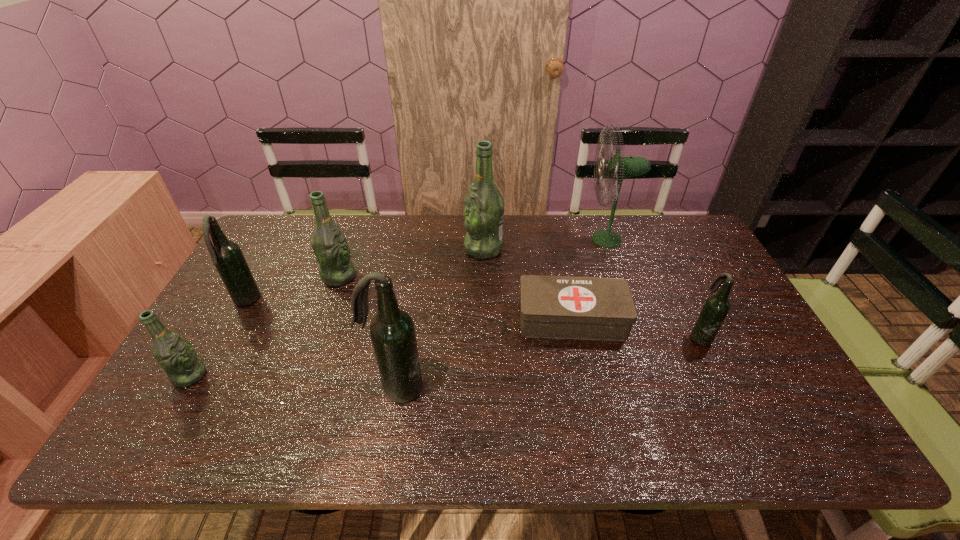
I want to click on blank space that satisfies the following two spatial constraints: 1. on the back side of the fourth beer bottle from left to right; 2. on the left side of the shortest object, so click(407, 319).

This screenshot has width=960, height=540. In order to click on free location that satisfies the following two spatial constraints: 1. on the surface of the farthest beer bottle; 2. on the right side of the rightmost beer bottle in this screenshot , I will do `click(485, 335)`.

You are a GUI agent. You are given a task and a screenshot of the screen. Output one action in this format:
    pyautogui.click(x=<x>, y=<y>)
    Task: Click on the free point that satisfies the following two spatial constraints: 1. on the surface of the third object from left to right; 2. on the left side of the biggest dark beer bottle
    The width and height of the screenshot is (960, 540).
    Given the screenshot: What is the action you would take?
    pyautogui.click(x=300, y=388)

At what (x,y) coordinates should I click in order to perform the action: click on free space that satisfies the following two spatial constraints: 1. on the back side of the shortest object; 2. on the surface of the third object from left to right. Please return your answer as a coordinate pair (x, y). This screenshot has height=540, width=960. Looking at the image, I should click on (563, 276).

Where is `free spot that satisfies the following two spatial constraints: 1. on the surface of the fourth object from left to right; 2. on the right side of the leftmost green beer bottle`? This screenshot has height=540, width=960. free spot that satisfies the following two spatial constraints: 1. on the surface of the fourth object from left to right; 2. on the right side of the leftmost green beer bottle is located at coordinates (182, 388).